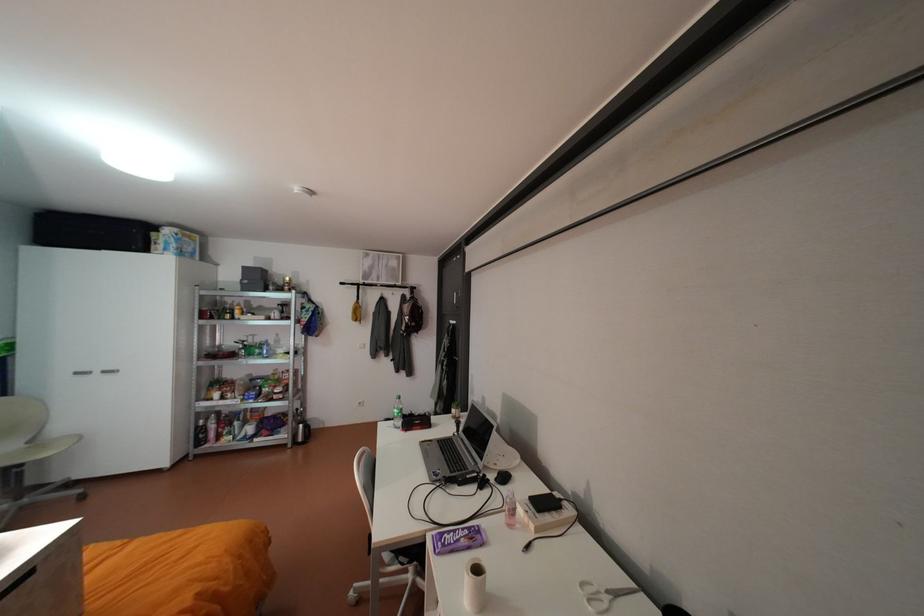
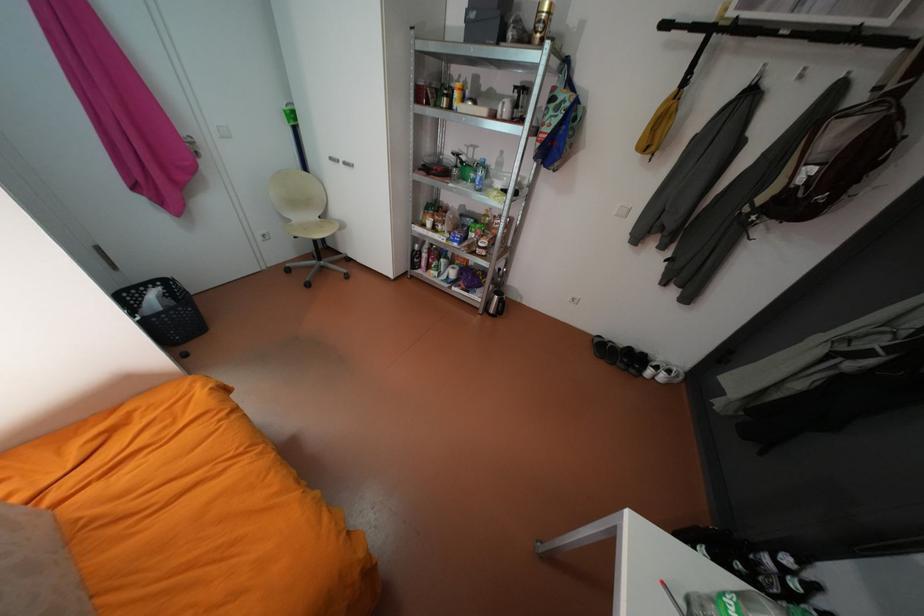
Find the pixel in the second image that matches pixel 295 444 in the first image.

(487, 308)